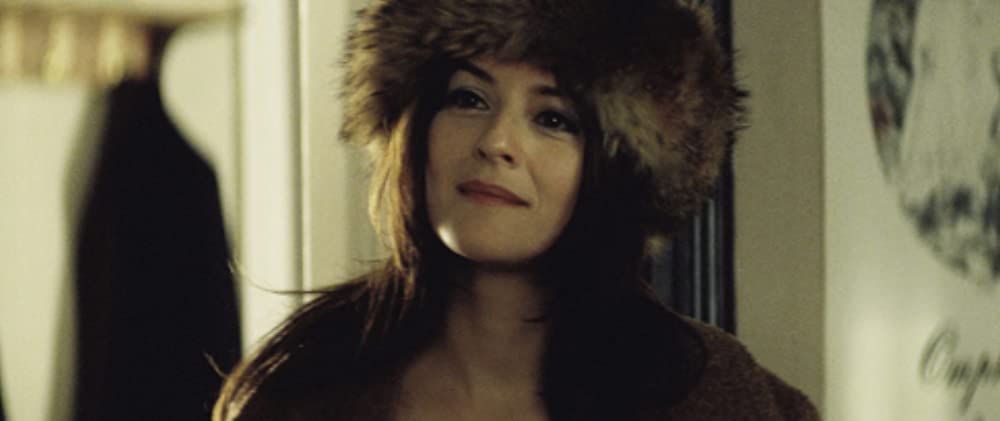
The image size is (1000, 421). I want to click on wall, so click(x=870, y=317).